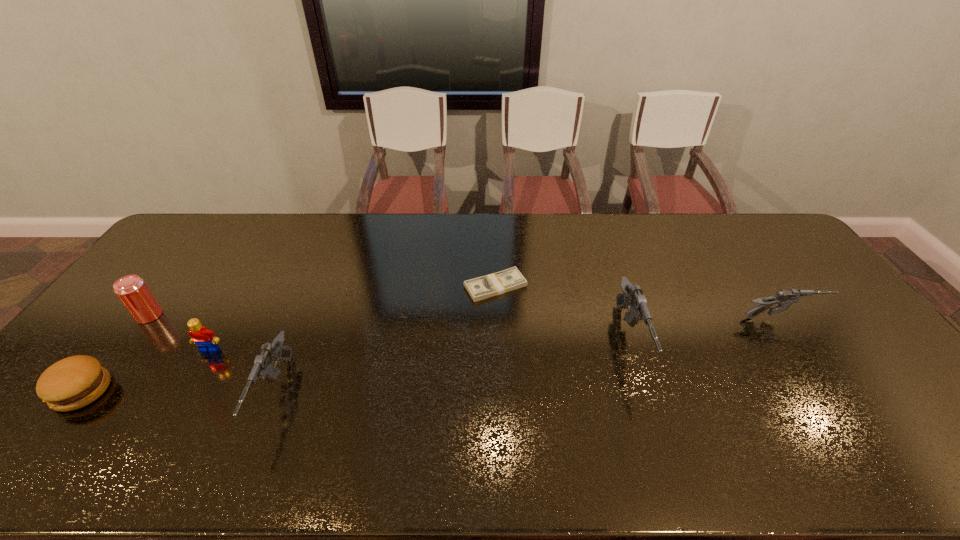
The height and width of the screenshot is (540, 960). I want to click on object located at the near left corner, so click(x=74, y=382).

The image size is (960, 540). I want to click on free space at the far edge of the desktop, so click(334, 249).

This screenshot has height=540, width=960. What are the coordinates of `free space at the near edge` in the screenshot? It's located at (130, 407).

I want to click on vacant space at the left edge, so click(154, 283).

Identify the location of blank space at the right edge. (801, 289).

Image resolution: width=960 pixels, height=540 pixels. I want to click on blank space at the near right corner, so click(x=856, y=399).

Where is `free space that is in between the beer can and the hamburger`? This screenshot has height=540, width=960. free space that is in between the beer can and the hamburger is located at coordinates (116, 353).

Identify the location of free space that is in between the fourth object from left to right and the sixth object from left to right. The width and height of the screenshot is (960, 540). (452, 368).

Identify the location of empty space between the rightmost object and the third object from left to right. (495, 334).

Where is `vacant space that is in between the beer can and the shortest object`? The width and height of the screenshot is (960, 540). vacant space that is in between the beer can and the shortest object is located at coordinates (323, 301).